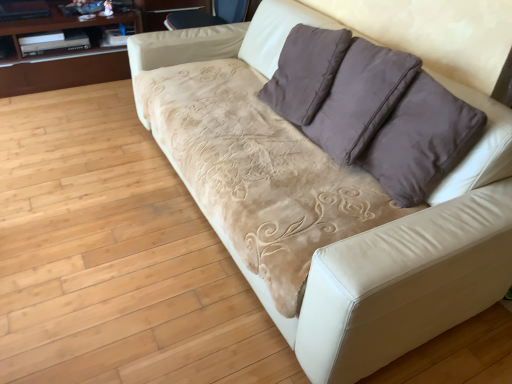
Question: From a real-world perspective, is wooden glossy dresser at upper left on top of velvet beige armchair at upper center?

Choices:
 (A) no
 (B) yes

Answer: (A)

Question: Would you say wooden glossy dresser at upper left is a long distance from velvet beige armchair at upper center?

Choices:
 (A) yes
 (B) no

Answer: (B)

Question: Considering the relative sizes of wooden glossy dresser at upper left and velvet beige armchair at upper center in the image provided, is wooden glossy dresser at upper left smaller than velvet beige armchair at upper center?

Choices:
 (A) no
 (B) yes

Answer: (A)

Question: From a real-world perspective, is wooden glossy dresser at upper left physically below velvet beige armchair at upper center?

Choices:
 (A) yes
 (B) no

Answer: (A)

Question: Would you say wooden glossy dresser at upper left is outside velvet beige armchair at upper center?

Choices:
 (A) yes
 (B) no

Answer: (A)

Question: Considering the relative sizes of wooden glossy dresser at upper left and velvet beige armchair at upper center in the image provided, is wooden glossy dresser at upper left thinner than velvet beige armchair at upper center?

Choices:
 (A) yes
 (B) no

Answer: (B)

Question: Is brown suede pillow at upper right surrounded by velvet beige armchair at upper center?

Choices:
 (A) yes
 (B) no

Answer: (B)

Question: Is velvet beige armchair at upper center behind brown suede pillow at upper right?

Choices:
 (A) yes
 (B) no

Answer: (A)

Question: Is velvet beige armchair at upper center positioned far away from brown suede pillow at upper right?

Choices:
 (A) yes
 (B) no

Answer: (A)

Question: Is velvet beige armchair at upper center positioned with its back to brown suede pillow at upper right?

Choices:
 (A) yes
 (B) no

Answer: (B)

Question: From a real-world perspective, is velvet beige armchair at upper center positioned under brown suede pillow at upper right based on gravity?

Choices:
 (A) no
 (B) yes

Answer: (B)

Question: From the image's perspective, does velvet beige armchair at upper center appear lower than brown suede pillow at upper right?

Choices:
 (A) no
 (B) yes

Answer: (A)

Question: Does velvet beige armchair at upper center have a greater height compared to wooden glossy dresser at upper left?

Choices:
 (A) yes
 (B) no

Answer: (B)